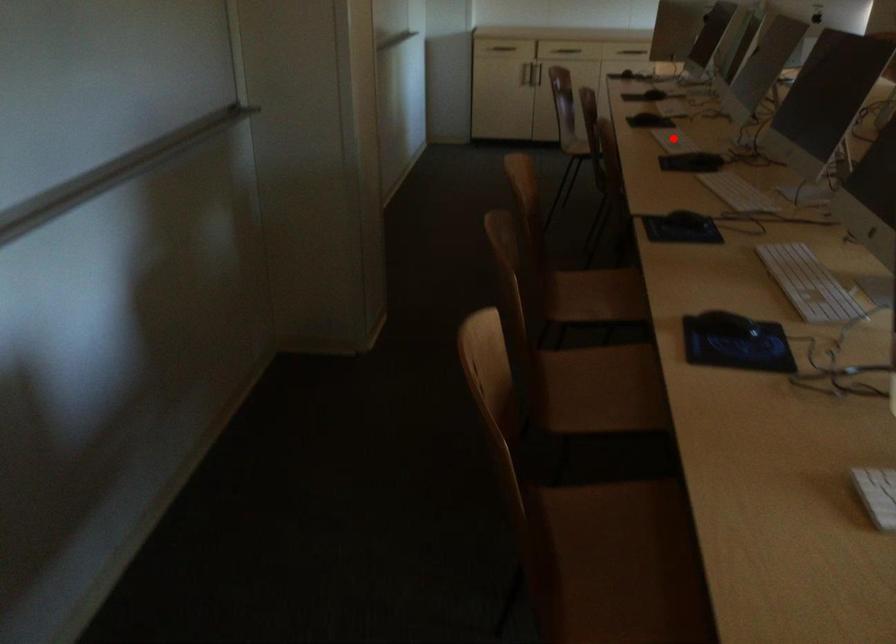
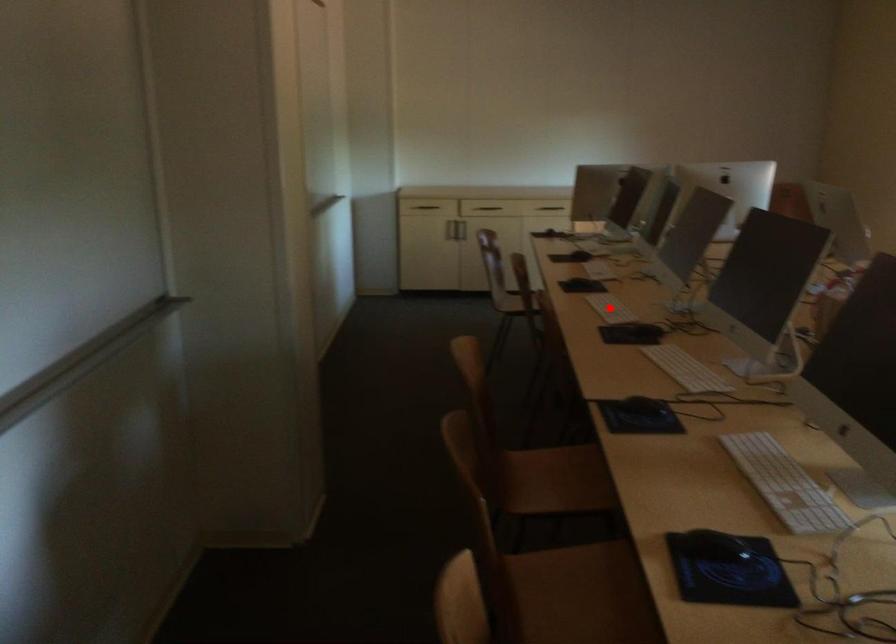
I am providing you with two images of the same scene from different viewpoints. A red point is marked on the first image and another point is marked on the second image. Is the marked point in image1 the same physical position as the marked point in image2?

Yes